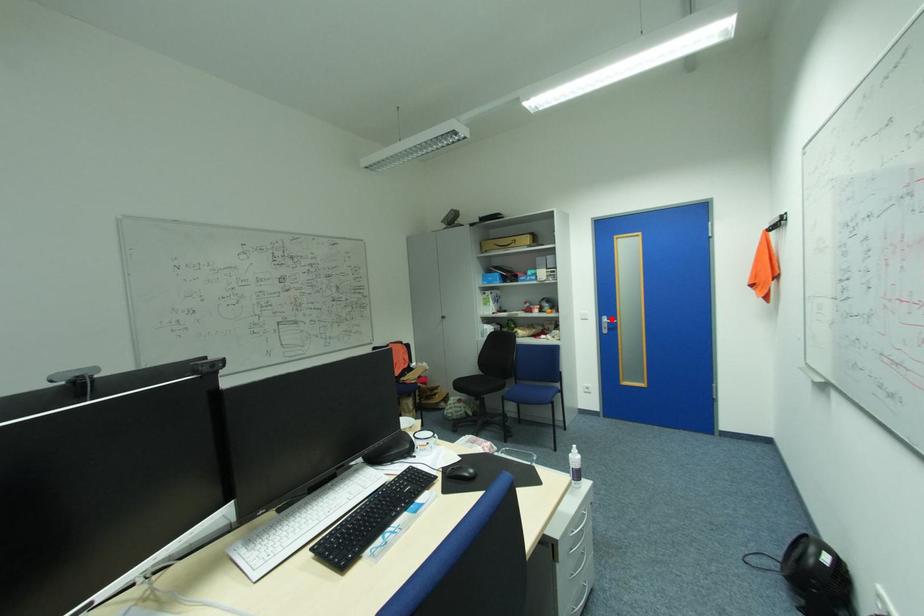
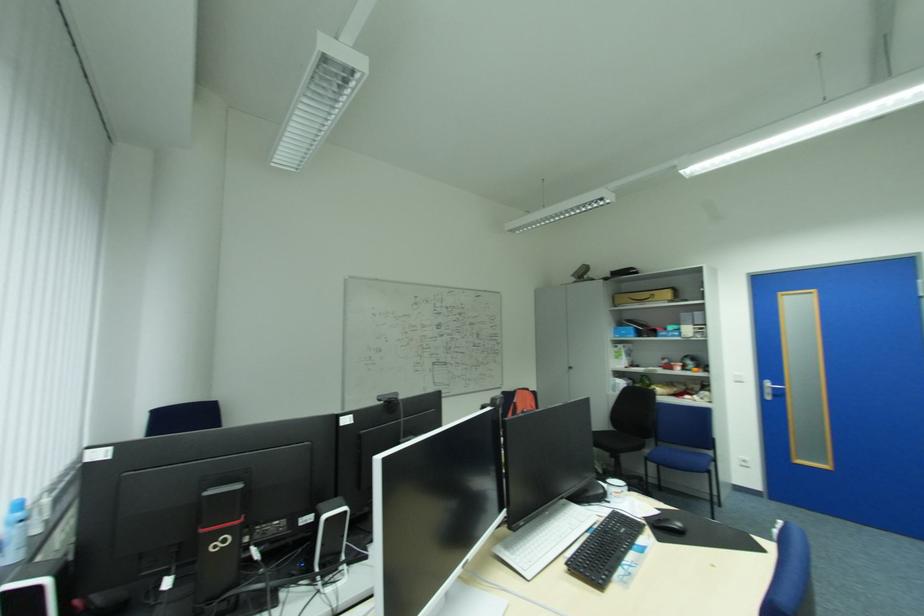
Where in the second image is the point corresponding to the highlighted location from the first image?

(774, 384)